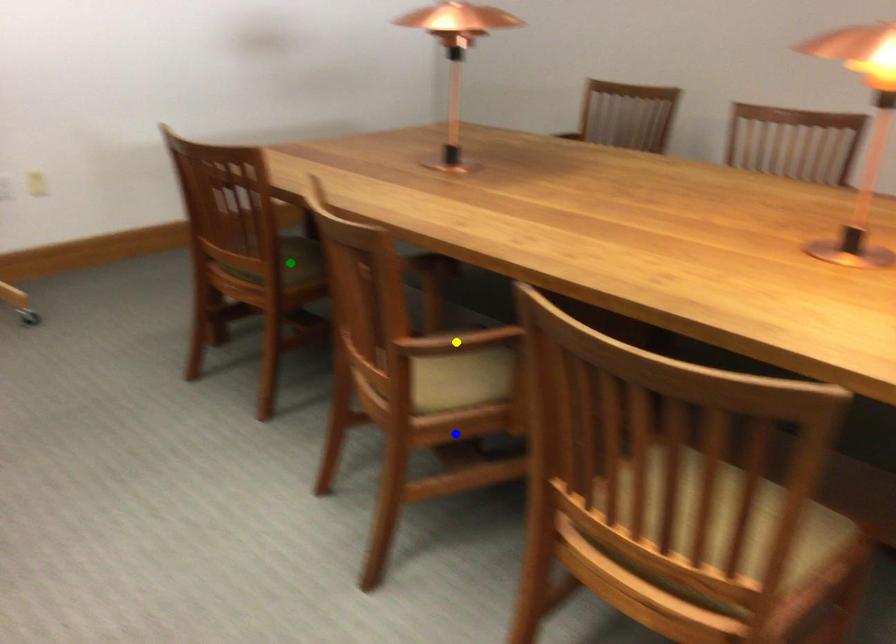
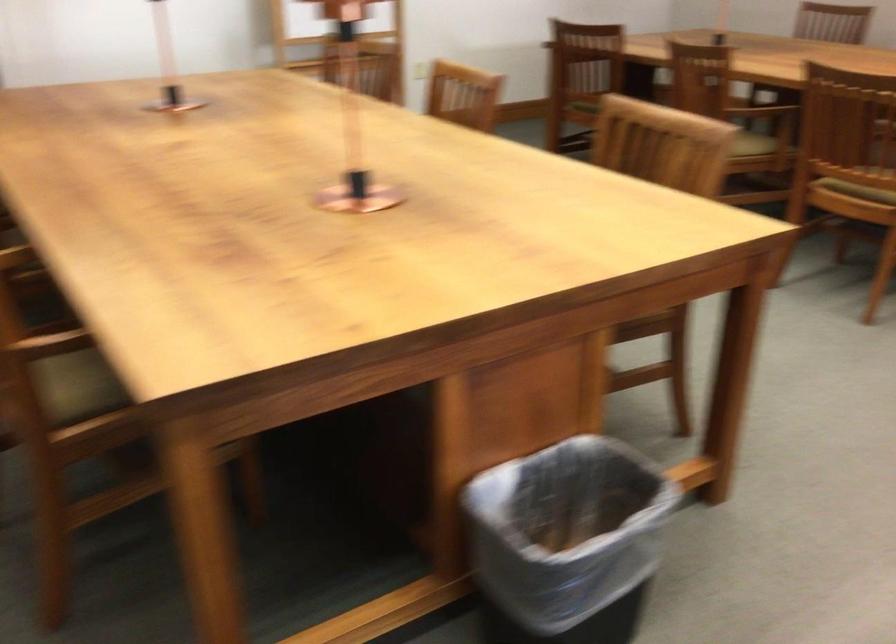
I am providing you with two images of the same scene from different viewpoints. Three points are marked in image1. Which point corresponds to a part or object that is occluded in image2?In image1, three points are marked. Which of them correspond to a part or object that is occluded in image2?Among the three points shown in image1, which one corresponds to a part or object that is no longer visible due to occlusion in image2?

green point, yellow point